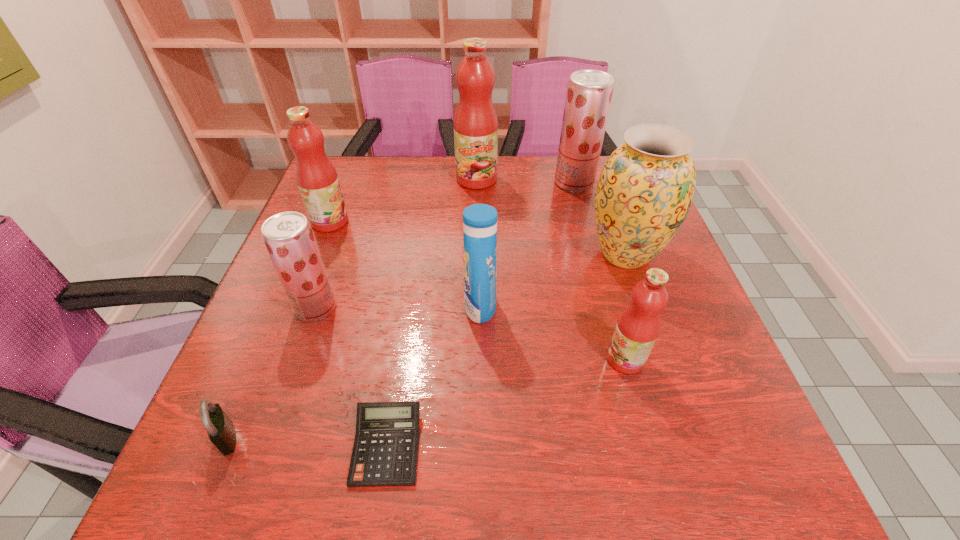
Locate which object is the fourth closest to the bigger strawberry fruit juice. Please provide its 2D coordinates. Your answer should be formatted as a tuple, i.e. [(x, y)], where the tuple contains the x and y coordinates of a point satisfying the conditions above.

[(637, 328)]

Choose which fruit juice is the nearest neighbor to the leftmost pink fruit juice. Please provide its 2D coordinates. Your answer should be formatted as a tuple, i.e. [(x, y)], where the tuple contains the x and y coordinates of a point satisfying the conditions above.

[(288, 236)]

The image size is (960, 540). Find the location of `fruit juice that is the fifth nearest to the shortest object`. fruit juice that is the fifth nearest to the shortest object is located at coordinates (589, 92).

Locate which pink fruit juice ranks third in proximity to the shortest object. Please provide its 2D coordinates. Your answer should be formatted as a tuple, i.e. [(x, y)], where the tuple contains the x and y coordinates of a point satisfying the conditions above.

[(475, 123)]

This screenshot has height=540, width=960. In order to click on the closest pink fruit juice to the leftmost pink fruit juice in this screenshot , I will do `click(475, 123)`.

At what (x,y) coordinates should I click in order to perform the action: click on free space in the image that satisfies the following two spatial constraints: 1. on the front side of the vase; 2. on the front-facing side of the detergent. Please return your answer as a coordinate pair (x, y). This screenshot has height=540, width=960. Looking at the image, I should click on (643, 307).

Locate an element on the screen. vacant region that satisfies the following two spatial constraints: 1. on the back side of the farther strawberry fruit juice; 2. on the right side of the padlock is located at coordinates (334, 183).

You are a GUI agent. You are given a task and a screenshot of the screen. Output one action in this format:
    pyautogui.click(x=<x>, y=<y>)
    Task: Click on the vacant area that satisfies the following two spatial constraints: 1. on the front label of the leftmost pink fruit juice; 2. on the front side of the padlock
    The width and height of the screenshot is (960, 540).
    Given the screenshot: What is the action you would take?
    pyautogui.click(x=246, y=437)

This screenshot has width=960, height=540. In order to click on vacant region that satisfies the following two spatial constraints: 1. on the front label of the nearer strawberry fruit juice; 2. on the left side of the second smallest pink fruit juice in this screenshot , I will do `click(297, 308)`.